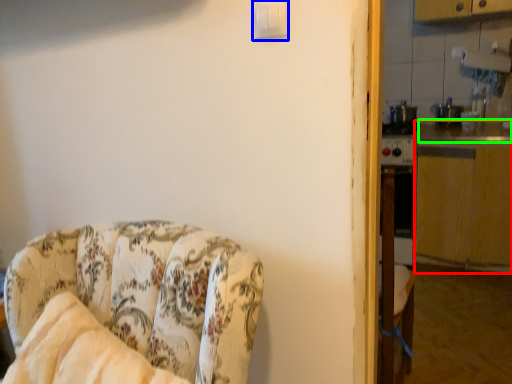
Question: Which object is the farthest from counter top (highlighted by a red box)? Choose among these: light switch (highlighted by a blue box) or counter top (highlighted by a green box).

Choices:
 (A) light switch
 (B) counter top

Answer: (A)